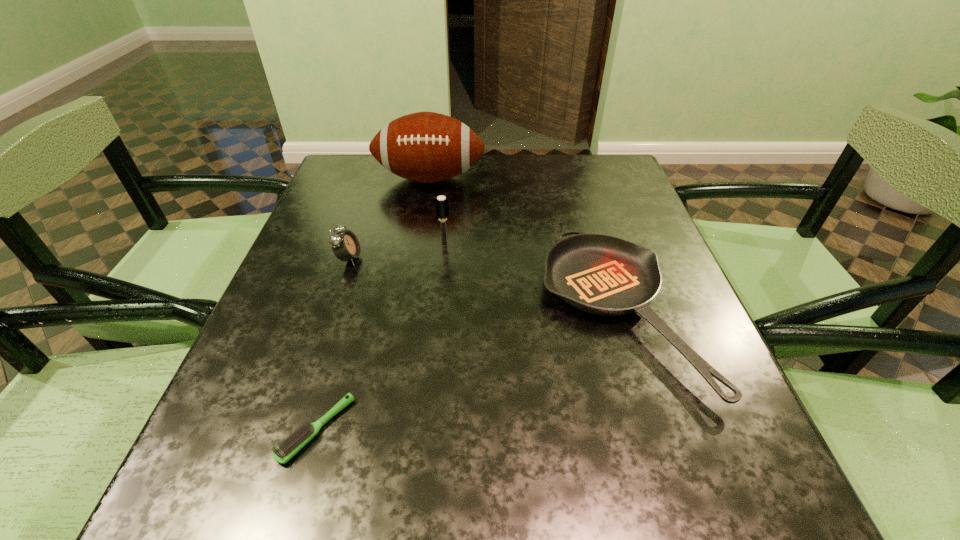
You are a GUI agent. You are given a task and a screenshot of the screen. Output one action in this format:
    pyautogui.click(x=<x>, y=<y>)
    Task: Click on the object that is positioned at the far left corner
    
    Given the screenshot: What is the action you would take?
    427,147

You are a GUI agent. You are given a task and a screenshot of the screen. Output one action in this format:
    pyautogui.click(x=<x>, y=<y>)
    Task: Click on the object present at the near left corner
    
    Given the screenshot: What is the action you would take?
    pyautogui.click(x=297, y=440)

Image resolution: width=960 pixels, height=540 pixels. I want to click on vacant space at the far edge of the desktop, so pyautogui.click(x=478, y=196).

Where is `free space at the left edge of the desktop`? Image resolution: width=960 pixels, height=540 pixels. free space at the left edge of the desktop is located at coordinates (348, 315).

What are the coordinates of `vacant space at the right edge of the desktop` in the screenshot? It's located at coord(623,211).

At what (x,y) coordinates should I click in order to perform the action: click on free space at the far left corner of the desktop. Please return your answer as a coordinate pair (x, y). Looking at the image, I should click on (341, 158).

Find the location of a particular element. The height and width of the screenshot is (540, 960). free space at the near left corner of the desktop is located at coordinates (236, 475).

Locate an element on the screen. Image resolution: width=960 pixels, height=540 pixels. free space at the near right corner of the desktop is located at coordinates (741, 464).

Locate an element on the screen. The height and width of the screenshot is (540, 960). free space between the taller hairbrush and the fourth tallest object is located at coordinates (531, 279).

The height and width of the screenshot is (540, 960). Find the location of `free point between the tallest object and the third tallest object`. free point between the tallest object and the third tallest object is located at coordinates (390, 218).